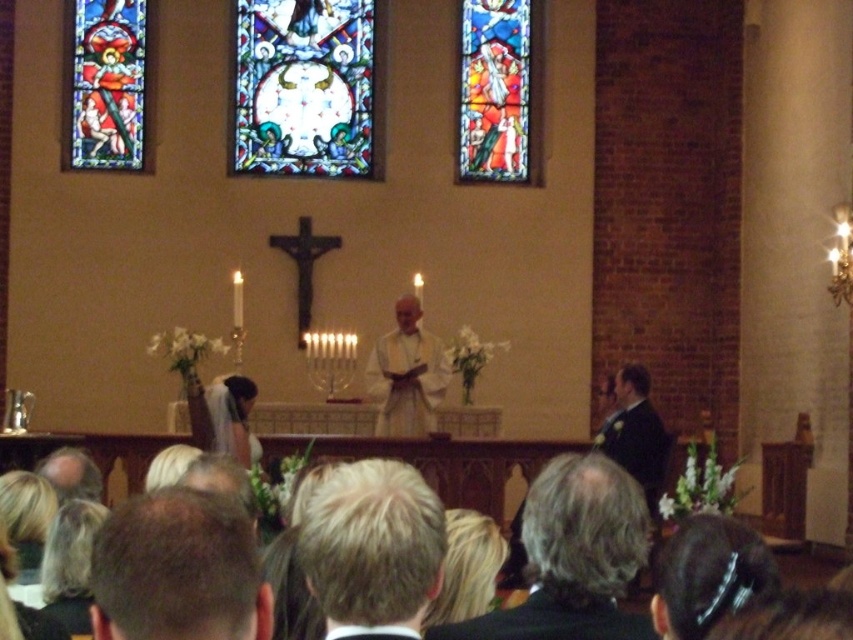
Question: Which point is closer to the camera taking this photo?

Choices:
 (A) (86, 168)
 (B) (225, 426)
 (C) (332, 152)
 (D) (352, 600)

Answer: (D)

Question: Estimate the real-world distances between objects in this image. Which object is closer to the matte stained glass window at upper left?

Choices:
 (A) stained glass window at center
 (B) stained glass window at upper center
 (C) white cloth at center
 (D) blonde hair at center

Answer: (A)

Question: Is stained glass window at upper center closer to the viewer compared to matte stained glass window at upper left?

Choices:
 (A) yes
 (B) no

Answer: (B)

Question: Can you confirm if white cloth at center is bigger than white satin veil at upper center?

Choices:
 (A) no
 (B) yes

Answer: (B)

Question: Which object is farther from the camera taking this photo?

Choices:
 (A) white satin veil at upper center
 (B) blonde hair at center

Answer: (A)

Question: In this image, where is matte stained glass window at upper left located relative to white cloth at center?

Choices:
 (A) left
 (B) right

Answer: (A)